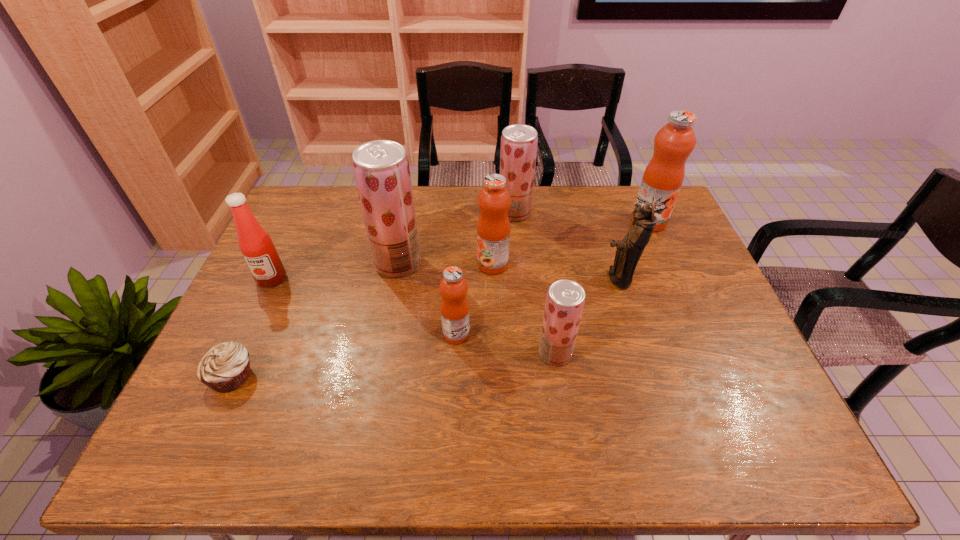
Identify the location of the second farthest strawberry fruit juice. (381, 168).

The image size is (960, 540). I want to click on the leftmost strawberry fruit juice, so click(381, 168).

What are the coordinates of `the farthest orange fruit juice` in the screenshot? It's located at [663, 177].

At what (x,y) coordinates should I click in order to perform the action: click on the rightmost orange fruit juice. Please return your answer as a coordinate pair (x, y). This screenshot has width=960, height=540. Looking at the image, I should click on (663, 177).

You are a GUI agent. You are given a task and a screenshot of the screen. Output one action in this format:
    pyautogui.click(x=<x>, y=<y>)
    Task: Click on the farthest strawberry fruit juice
    
    Given the screenshot: What is the action you would take?
    pyautogui.click(x=519, y=142)

What are the coordinates of `the second orange fruit juice from right to left` in the screenshot? It's located at (493, 228).

Where is `the second smallest orange fruit juice`? The height and width of the screenshot is (540, 960). the second smallest orange fruit juice is located at coordinates (493, 228).

Find the location of a particular element. figurine is located at coordinates (629, 250).

The height and width of the screenshot is (540, 960). Find the location of `red condiment`. red condiment is located at coordinates (256, 245).

Identify the location of the smallest strawberry fruit juice. The height and width of the screenshot is (540, 960). (565, 300).